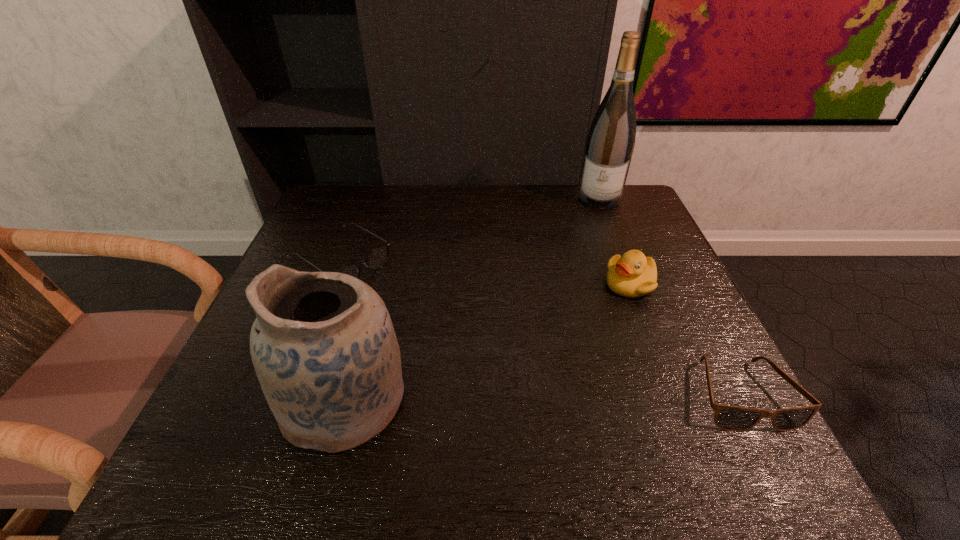
Locate an element on the screen. The height and width of the screenshot is (540, 960). free point located on the label of the tallest object is located at coordinates (580, 278).

Locate an element on the screen. free space located on the label of the tallest object is located at coordinates (594, 220).

What are the coordinates of `free space located 0.150m on the label of the tallest object` in the screenshot? It's located at (590, 238).

The height and width of the screenshot is (540, 960). I want to click on vacant area situated through the lenses of the spectacles, so [x=469, y=344].

The image size is (960, 540). Find the location of `blank area located 0.270m through the lenses of the spectacles`. blank area located 0.270m through the lenses of the spectacles is located at coordinates (462, 339).

Identify the location of vacant space located 0.100m through the lenses of the spectacles. (404, 302).

Locate an element on the screen. object that is at the far edge is located at coordinates (610, 143).

What are the coordinates of `pottery present at the near edge` in the screenshot? It's located at (323, 346).

This screenshot has width=960, height=540. I want to click on sunglasses that is at the near edge, so (730, 418).

Find the location of a particular element. The width and height of the screenshot is (960, 540). pottery that is positioned at the left edge is located at coordinates (323, 346).